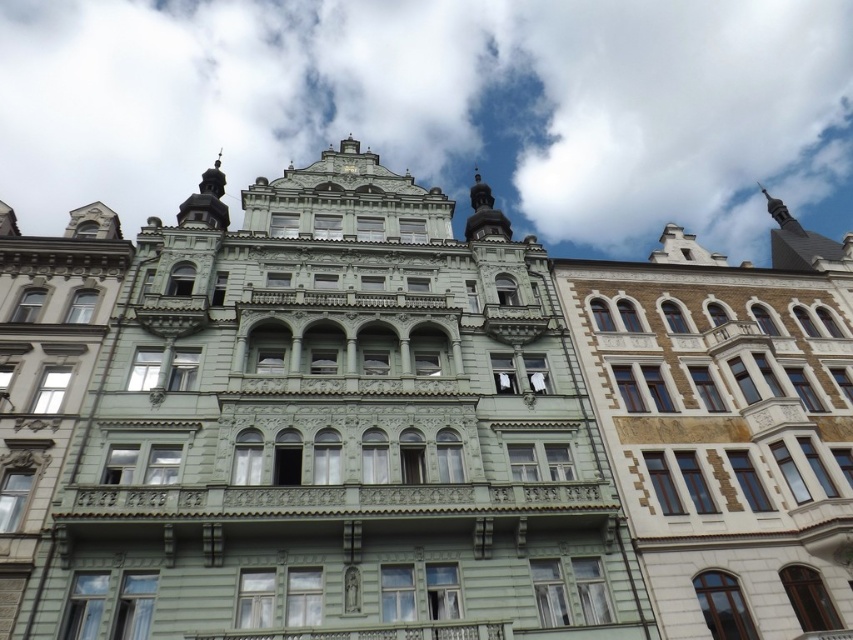
Question: Can you confirm if white fluffy cloud at upper center is wider than gold textured clock at upper center?

Choices:
 (A) no
 (B) yes

Answer: (B)

Question: Can you confirm if white fluffy cloud at upper center is thinner than gold textured clock at upper center?

Choices:
 (A) yes
 (B) no

Answer: (B)

Question: Where is white fluffy cloud at upper center located in relation to gold textured clock at upper center in the image?

Choices:
 (A) above
 (B) below

Answer: (A)